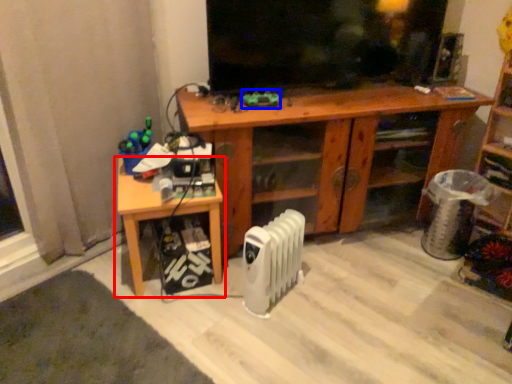
Question: Which object appears farthest to the camera in this image, table (highlighted by a red box) or toy (highlighted by a blue box)?

Choices:
 (A) table
 (B) toy

Answer: (B)